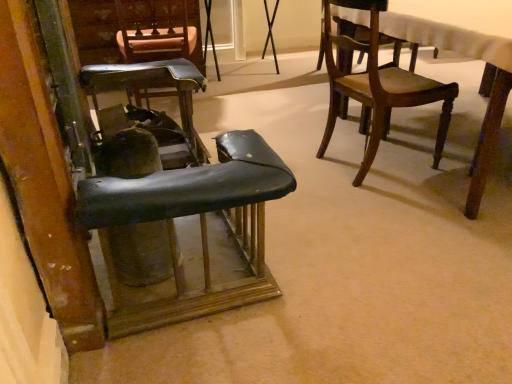
Find the location of a particular element. unoccupied region to the right of leather-like brown chair at upper center, which is the 1th chair from left to right is located at coordinates (237, 98).